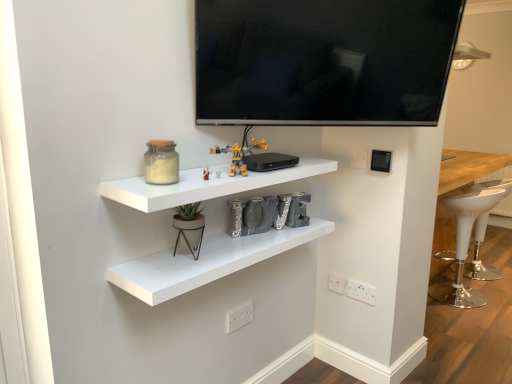
Image resolution: width=512 pixels, height=384 pixels. What are the coordinates of `space that is in front of matte white pot at center, the third toy from the right` in the screenshot? It's located at (178, 266).